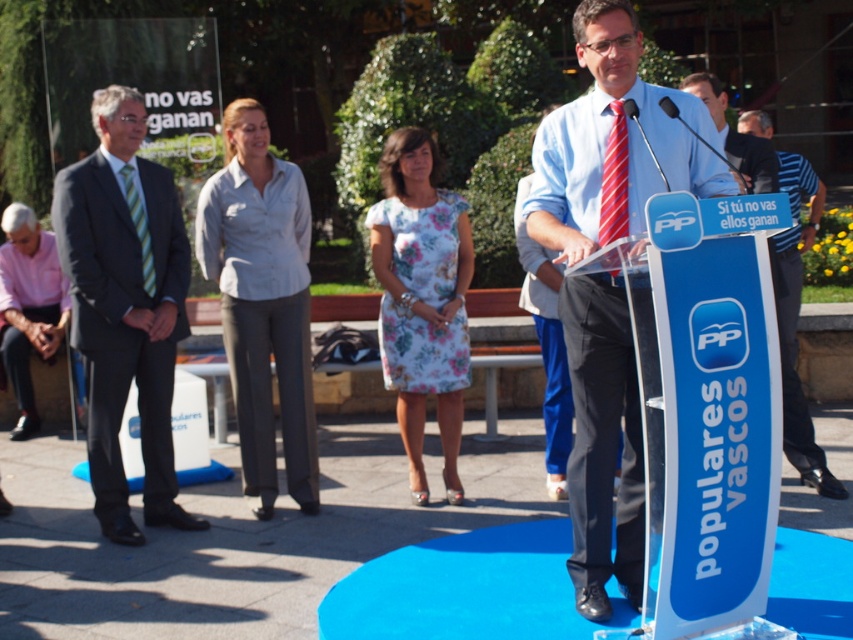
Is dark gray suit at left wider than red striped tie at center?

Correct, the width of dark gray suit at left exceeds that of red striped tie at center.

Is dark gray suit at left above red striped tie at center?

Actually, dark gray suit at left is below red striped tie at center.

Measure the distance between dark gray suit at left and camera.

They are 22.82 feet apart.

Identify the location of dark gray suit at left. (125, 307).

Can you confirm if light blue shirt and tie at center is thinner than red striped tie at center?

No, light blue shirt and tie at center is not thinner than red striped tie at center.

Who is positioned more to the left, light blue shirt and tie at center or red striped tie at center?

Positioned to the left is red striped tie at center.

Is point (636, 64) positioned before point (614, 104)?

No, it is not.

Where is `light blue shirt and tie at center`? The image size is (853, 640). light blue shirt and tie at center is located at coordinates (607, 134).

How much distance is there between light blue shirt and tie at center and light blue cotton shirt at center?

light blue shirt and tie at center and light blue cotton shirt at center are 8.58 feet apart.

This screenshot has height=640, width=853. Describe the element at coordinates (607, 134) in the screenshot. I see `light blue shirt and tie at center` at that location.

Find the location of `light blue shirt and tie at center`. light blue shirt and tie at center is located at coordinates (607, 134).